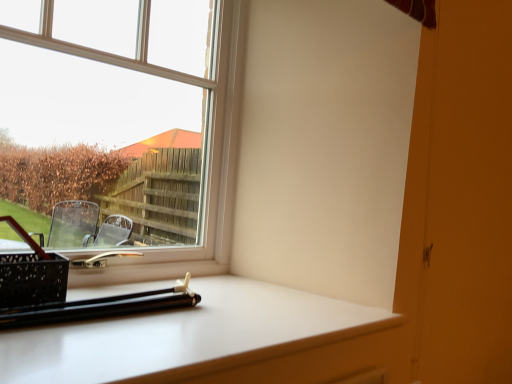
Question: Can you confirm if clear glass window at upper left is positioned to the right of white glossy computer desk at lower center?

Choices:
 (A) no
 (B) yes

Answer: (A)

Question: Can you confirm if clear glass window at upper left is shorter than white glossy computer desk at lower center?

Choices:
 (A) no
 (B) yes

Answer: (A)

Question: Does clear glass window at upper left touch white glossy computer desk at lower center?

Choices:
 (A) no
 (B) yes

Answer: (A)

Question: Does clear glass window at upper left have a greater height compared to white glossy computer desk at lower center?

Choices:
 (A) yes
 (B) no

Answer: (A)

Question: Is clear glass window at upper left far away from white glossy computer desk at lower center?

Choices:
 (A) yes
 (B) no

Answer: (B)

Question: Is clear glass window at upper left closer to the viewer compared to white glossy computer desk at lower center?

Choices:
 (A) yes
 (B) no

Answer: (B)

Question: Is white glossy computer desk at lower center shorter than clear glass window at upper left?

Choices:
 (A) no
 (B) yes

Answer: (B)

Question: Is white glossy computer desk at lower center bigger than clear glass window at upper left?

Choices:
 (A) yes
 (B) no

Answer: (B)

Question: Is white glossy computer desk at lower center not close to clear glass window at upper left?

Choices:
 (A) no
 (B) yes

Answer: (A)

Question: Is white glossy computer desk at lower center oriented away from clear glass window at upper left?

Choices:
 (A) no
 (B) yes

Answer: (A)

Question: Does white glossy computer desk at lower center come behind clear glass window at upper left?

Choices:
 (A) yes
 (B) no

Answer: (B)

Question: From the image's perspective, is white glossy computer desk at lower center beneath clear glass window at upper left?

Choices:
 (A) no
 (B) yes

Answer: (B)

Question: Is clear glass window at upper left in front of or behind white glossy computer desk at lower center in the image?

Choices:
 (A) behind
 (B) front

Answer: (A)